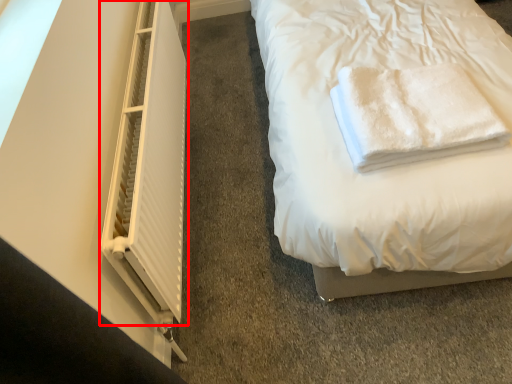
Question: From the image's perspective, where is window (annotated by the red box) located relative to towel?

Choices:
 (A) below
 (B) above

Answer: (A)